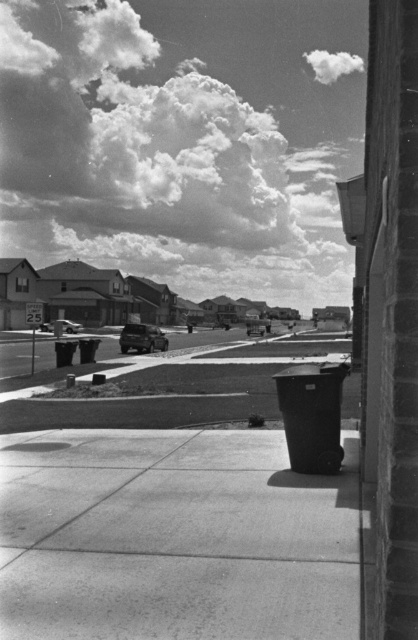
Can you confirm if shiny silver sedan at center is positioned to the left of shiny silver car at center?

Incorrect, shiny silver sedan at center is not on the left side of shiny silver car at center.

Is point (147, 342) farther from viewer compared to point (45, 323)?

No, (147, 342) is closer to viewer.

This screenshot has height=640, width=418. What are the coordinates of `shiny silver sedan at center` in the screenshot? It's located at point(142,339).

Is point (229, 531) farther from camera compared to point (119, 340)?

That is False.

Does smooth concrete sidewalk at center have a smaller size compared to shiny silver sedan at center?

Yes.

Between point (106, 577) and point (148, 342), which one is positioned behind?

The point (148, 342) is more distant.

The width and height of the screenshot is (418, 640). I want to click on smooth concrete sidewalk at center, so click(x=173, y=538).

Between smooth concrete sidewalk at center and shiny silver car at center, which one appears on the right side from the viewer's perspective?

smooth concrete sidewalk at center is more to the right.

The image size is (418, 640). What do you see at coordinates (173, 538) in the screenshot?
I see `smooth concrete sidewalk at center` at bounding box center [173, 538].

Image resolution: width=418 pixels, height=640 pixels. Find the location of `smooth concrete sidewalk at center`. smooth concrete sidewalk at center is located at coordinates (173, 538).